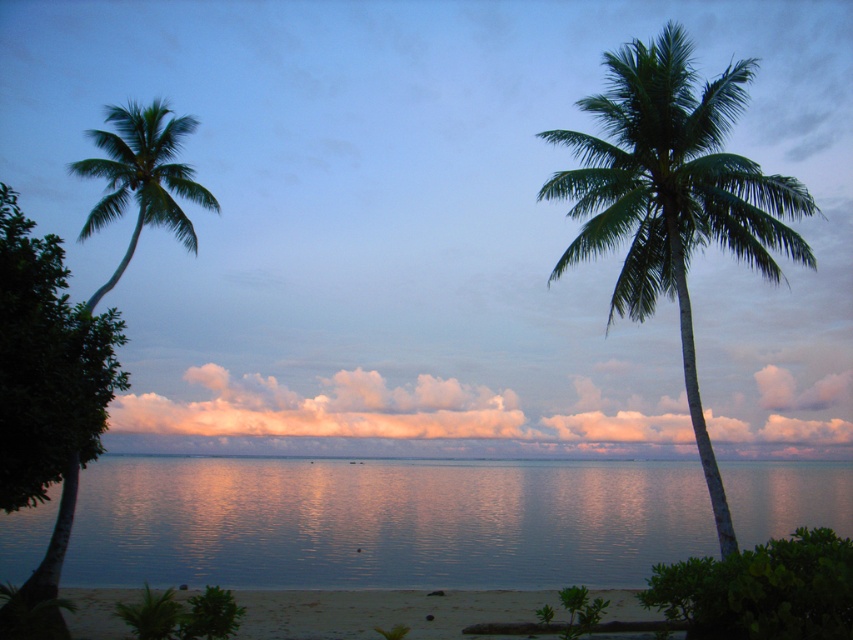
Question: Which point appears farthest from the camera in this image?

Choices:
 (A) (839, 381)
 (B) (677, 164)
 (C) (335, 580)

Answer: (A)

Question: Which of the following is the closest to the observer?

Choices:
 (A) click(300, 593)
 (B) click(625, 410)
 (C) click(624, 115)
 (D) click(103, 480)

Answer: (C)

Question: Can you confirm if smooth blue water at center is positioned to the left of sandy beach at lower center?

Choices:
 (A) no
 (B) yes

Answer: (A)

Question: Where is smooth blue water at center located in relation to sandy beach at lower center in the image?

Choices:
 (A) right
 (B) left

Answer: (A)

Question: Does puffy cotton clouds at center have a greater width compared to green leafy palm tree at left?

Choices:
 (A) yes
 (B) no

Answer: (A)

Question: Which object is positioned closest to the sandy beach at lower center?

Choices:
 (A) puffy cotton clouds at center
 (B) green leafy palm tree at left

Answer: (B)